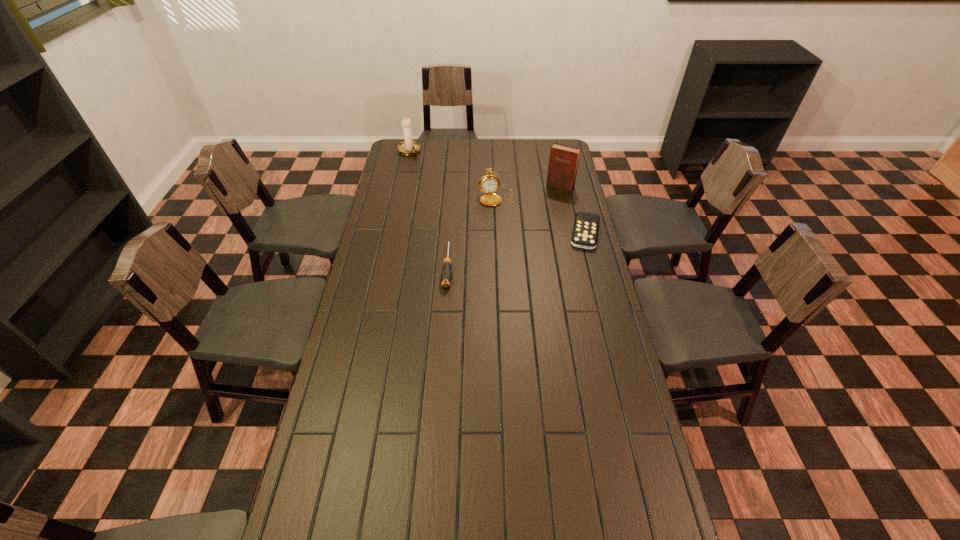
Find the location of a particular element. object that ranks as the closest to the fourth object from right to left is located at coordinates (488, 184).

In order to click on blank space that satisfies the following two spatial constraints: 1. on the back side of the diary; 2. on the right side of the third shortest object in this screenshot , I will do `click(496, 186)`.